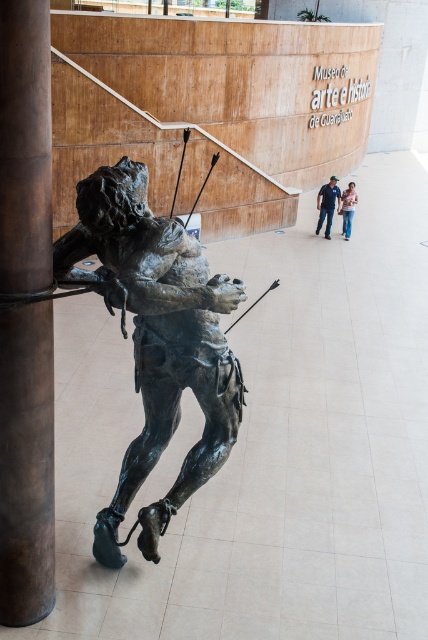
Question: Which object is positioned farthest from the bronze statue at center?

Choices:
 (A) jeans at center
 (B) blue denim jeans at lower center

Answer: (A)

Question: Which of the following is the farthest from the observer?

Choices:
 (A) (2, 228)
 (B) (344, 237)
 (C) (148, 259)

Answer: (B)

Question: Does bronze statue at center lie behind blue denim jeans at lower center?

Choices:
 (A) no
 (B) yes

Answer: (A)

Question: Which of the following is the closest to the observer?

Choices:
 (A) jeans at center
 (B) bronze statue at center
 (C) brown polished wood pillar at left
 (D) blue denim jeans at lower center

Answer: (C)

Question: Does brown polished wood pillar at left appear on the left side of jeans at center?

Choices:
 (A) no
 (B) yes

Answer: (B)

Question: From the image, what is the correct spatial relationship of blue denim jeans at lower center in relation to jeans at center?

Choices:
 (A) left
 (B) right

Answer: (A)